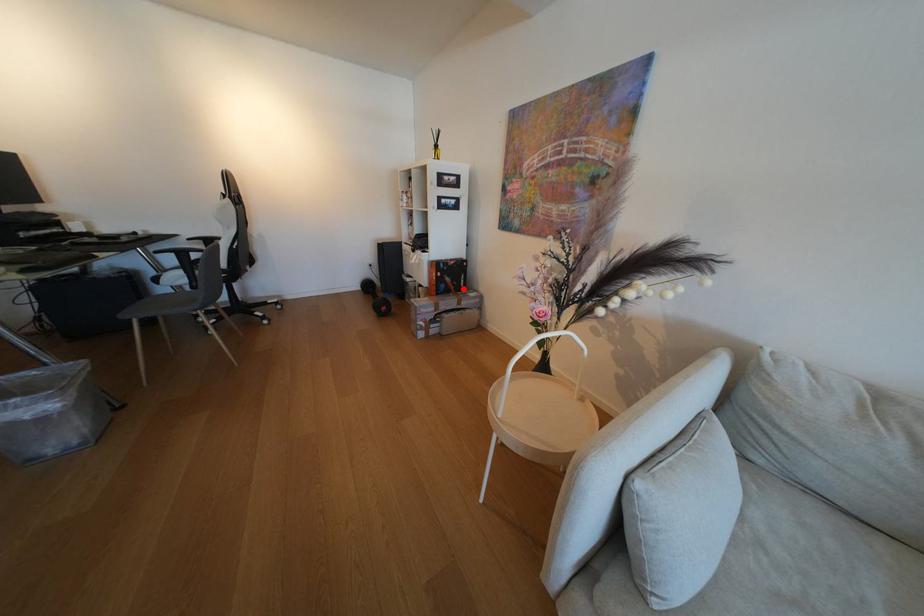
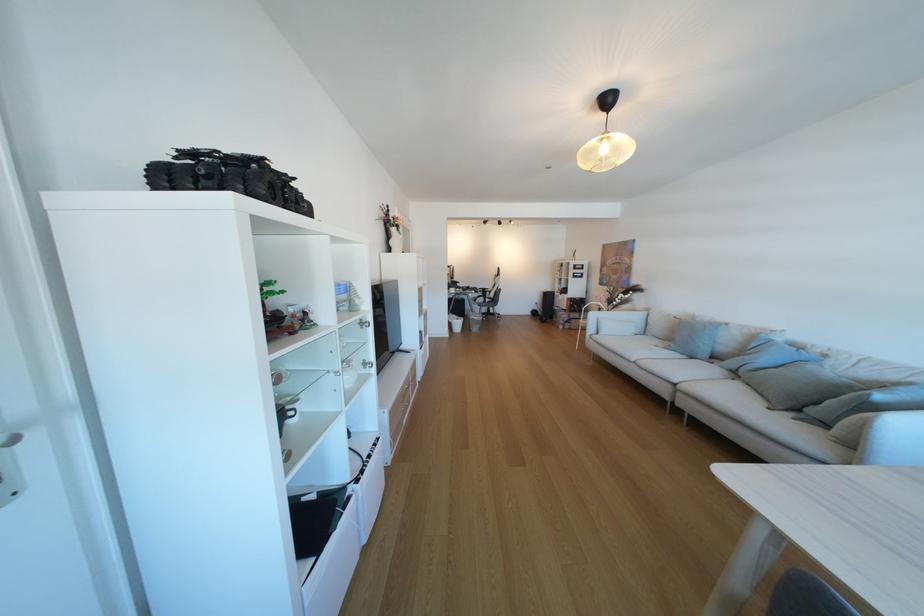
The point at the highlighted location is marked in the first image. Where is the corresponding point in the second image?

(589, 310)